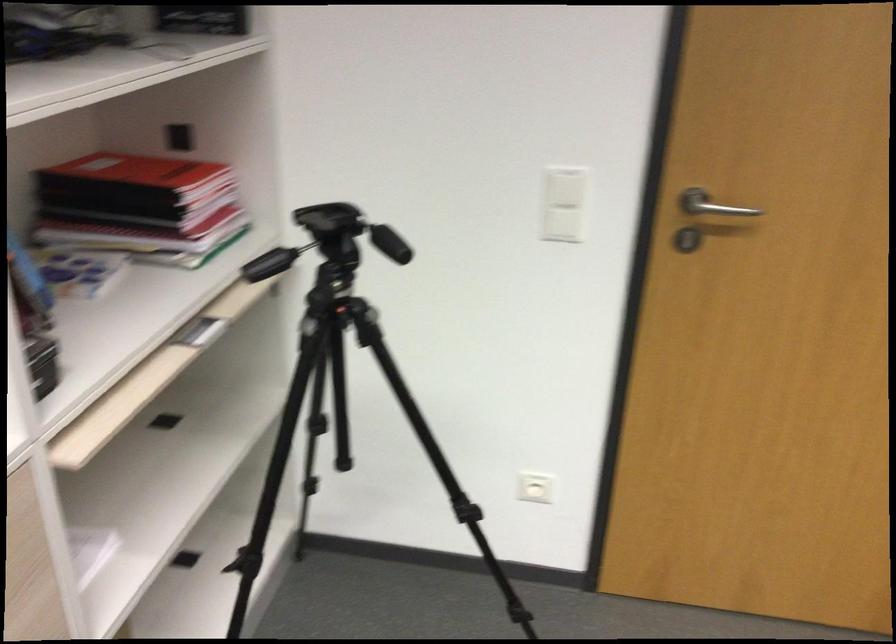
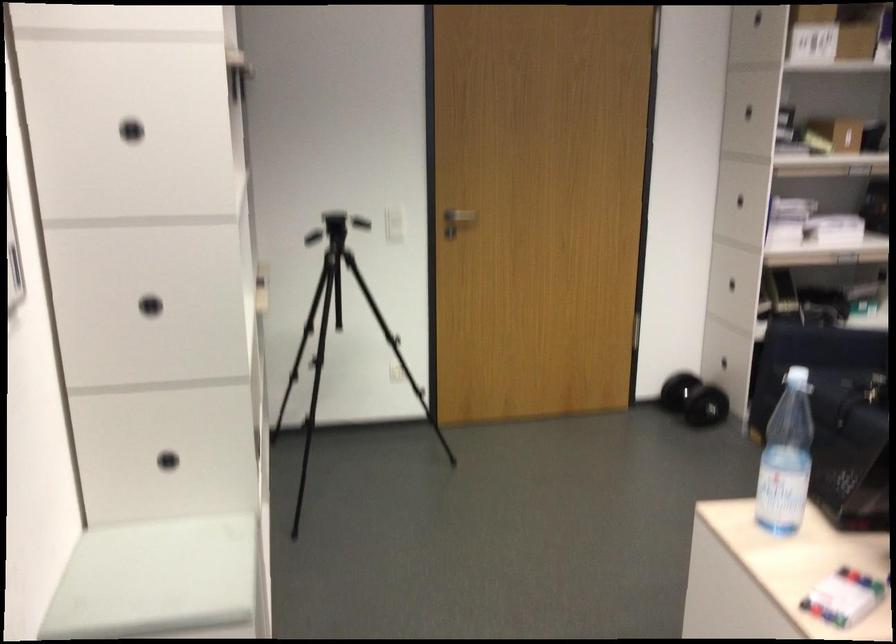
Locate, in the second image, the point that corresponds to (x=770, y=212) in the first image.

(460, 216)